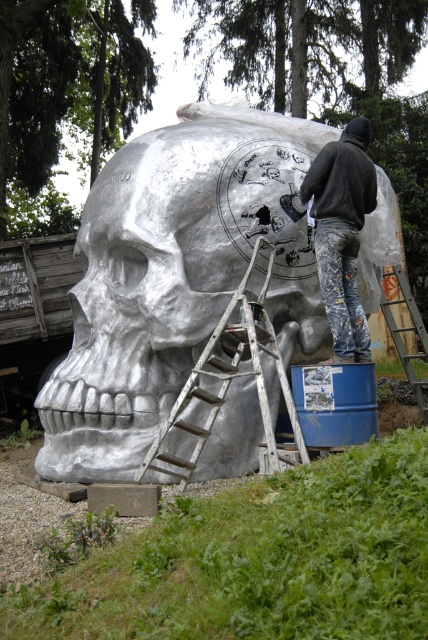
Looking at this image, you are standing in the outdoor area and want to take a photo of the brushed metal skull at center. If your camera has a maximum focus range of 5 meters, will you be able to capture a clear photo without moving closer?

The brushed metal skull at center is 5.86 meters away from the viewer. Since the camera can only focus up to 5 meters, you will not be able to capture a clear photo without moving closer.

You are an artist trying to sketch the sculpture. You notice the brushed metal skull at center and the brushed wood ladder at center. Which object is located to the left of the other?

The brushed metal skull at center is positioned on the left side of the brushed wood ladder at center.